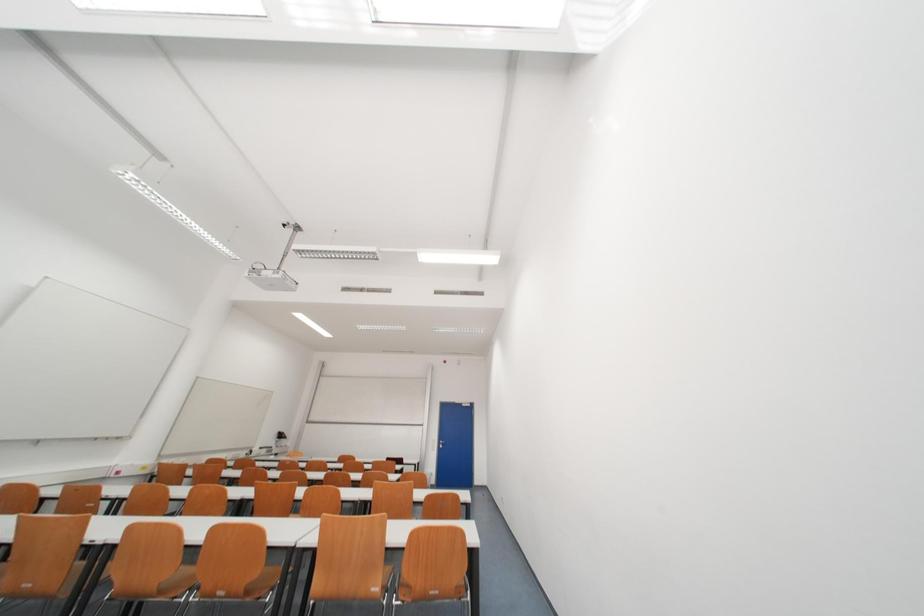
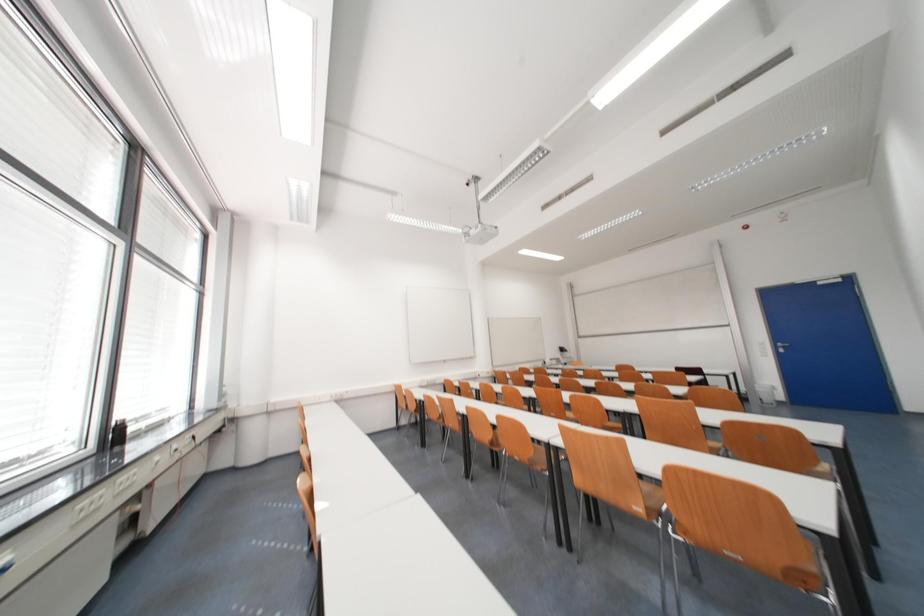
Question: The camera is either moving clockwise (left) or counter-clockwise (right) around the object. The first image is from the beginning of the video and the second image is from the end. Is the camera moving left or right when shooting the video?

Choices:
 (A) Left
 (B) Right

Answer: (B)